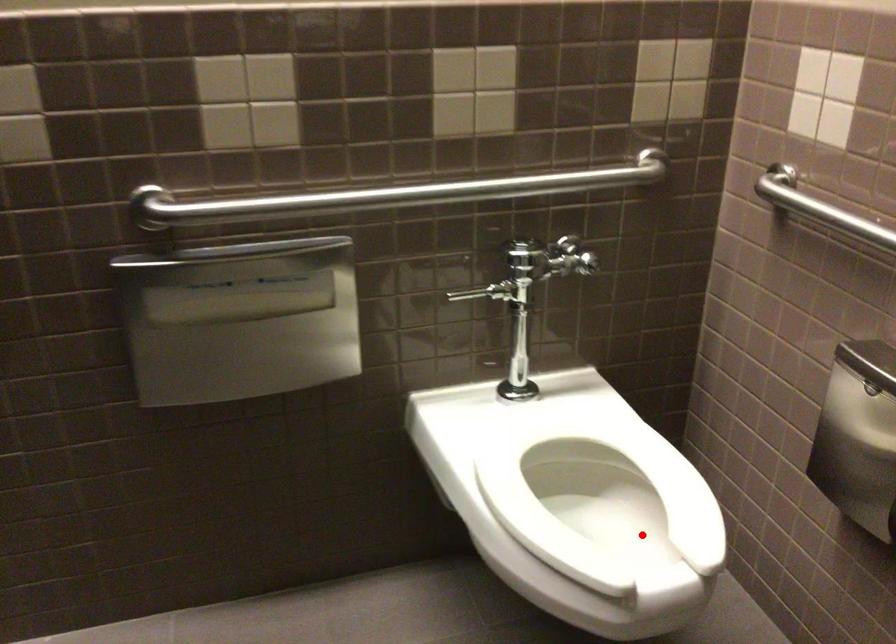
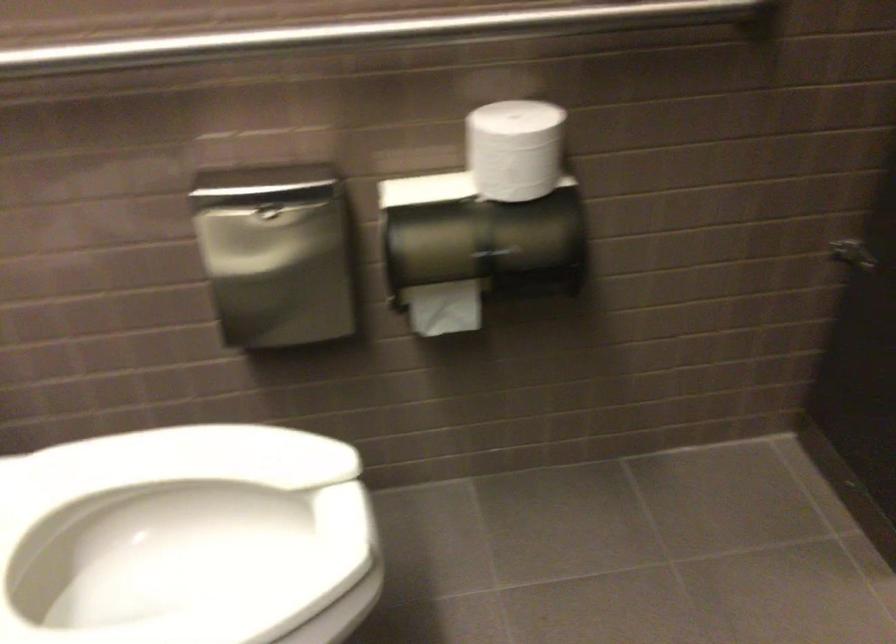
Question: I am providing you with two images of the same scene from different viewpoints. Given a red point in image1, look at the same physical point in image2. Is it:

Choices:
 (A) Closer to the viewpoint
 (B) Farther from the viewpoint

Answer: (A)